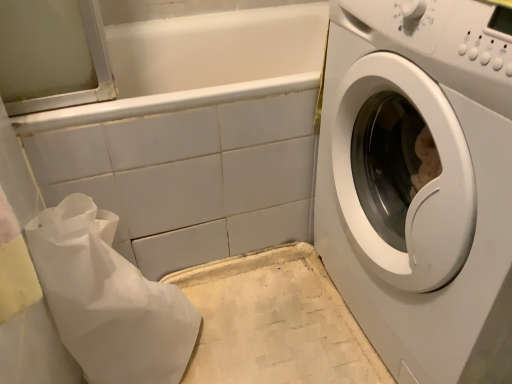
Question: Is white paper bag at lower left outside white textured mat at lower center?

Choices:
 (A) no
 (B) yes

Answer: (B)

Question: Is white paper bag at lower left smaller than white textured mat at lower center?

Choices:
 (A) yes
 (B) no

Answer: (B)

Question: Does white paper bag at lower left have a lesser width compared to white textured mat at lower center?

Choices:
 (A) no
 (B) yes

Answer: (B)

Question: From a real-world perspective, is white paper bag at lower left below white textured mat at lower center?

Choices:
 (A) yes
 (B) no

Answer: (B)

Question: Can you confirm if white paper bag at lower left is bigger than white textured mat at lower center?

Choices:
 (A) yes
 (B) no

Answer: (A)

Question: Could you tell me if white paper bag at lower left is facing white textured mat at lower center?

Choices:
 (A) no
 (B) yes

Answer: (B)

Question: Can you confirm if white glossy bathtub at upper center is shorter than white paper bag at lower left?

Choices:
 (A) yes
 (B) no

Answer: (B)

Question: Is white glossy bathtub at upper center at the right side of white paper bag at lower left?

Choices:
 (A) yes
 (B) no

Answer: (A)

Question: Is white glossy bathtub at upper center next to white paper bag at lower left and touching it?

Choices:
 (A) no
 (B) yes

Answer: (A)

Question: Would you say white glossy bathtub at upper center contains white paper bag at lower left?

Choices:
 (A) no
 (B) yes

Answer: (A)

Question: From a real-world perspective, is white glossy bathtub at upper center below white paper bag at lower left?

Choices:
 (A) yes
 (B) no

Answer: (B)

Question: From a real-world perspective, is white glossy bathtub at upper center positioned over white paper bag at lower left based on gravity?

Choices:
 (A) yes
 (B) no

Answer: (A)

Question: Considering the relative positions of white glossy washing machine at right and white glossy bathtub at upper center in the image provided, is white glossy washing machine at right behind white glossy bathtub at upper center?

Choices:
 (A) no
 (B) yes

Answer: (A)